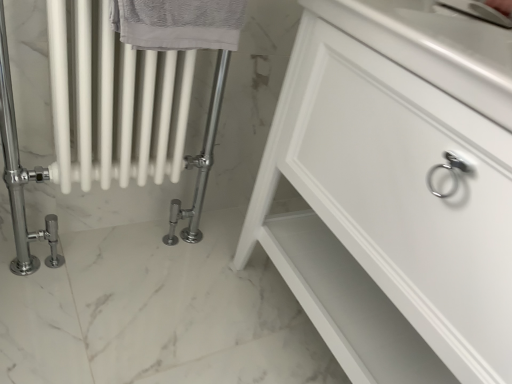
The width and height of the screenshot is (512, 384). In order to click on white glossy cabinet at center in this screenshot , I will do `click(388, 217)`.

Identify the location of white glossy radiator at left. This screenshot has height=384, width=512. (106, 119).

Is point (145, 48) positioned before point (121, 103)?

Yes, point (145, 48) is in front of point (121, 103).

Does gray textured towel at upper left lie in front of white glossy radiator at left?

Yes, gray textured towel at upper left is in front of white glossy radiator at left.

Is gray textured towel at upper left positioned far away from white glossy radiator at left?

No, gray textured towel at upper left is not far from white glossy radiator at left.

Can you tell me how much gray textured towel at upper left and white glossy radiator at left differ in facing direction?

There is a 0.00407-degree angle between the facing directions of gray textured towel at upper left and white glossy radiator at left.

Is white glossy cabinet at center bigger or smaller than white glossy radiator at left?

Clearly, white glossy cabinet at center is larger in size than white glossy radiator at left.

From the image's perspective, does white glossy cabinet at center appear higher than white glossy radiator at left?

No.

From a real-world perspective, is white glossy cabinet at center above or below white glossy radiator at left?

Clearly, from a real-world perspective, white glossy cabinet at center is above white glossy radiator at left.

Can you tell me how much white glossy cabinet at center and white glossy radiator at left differ in facing direction?

There is a 90.8-degree angle between the facing directions of white glossy cabinet at center and white glossy radiator at left.

I want to click on bath towel above the white glossy cabinet at center (from a real-world perspective), so pos(178,23).

Considering their positions, is white glossy cabinet at center located in front of or behind gray textured towel at upper left?

white glossy cabinet at center is in front of gray textured towel at upper left.

Is white glossy cabinet at center in contact with gray textured towel at upper left?

No, white glossy cabinet at center is not with gray textured towel at upper left.

Is white glossy radiator at left next to gray textured towel at upper left and touching it?

No, white glossy radiator at left is not touching gray textured towel at upper left.

Looking at this image, which is closer to the camera, [192,227] or [220,0]?

Point [192,227] appears to be farther away from the viewer than point [220,0].

From a real-world perspective, which is physically below, white glossy radiator at left or gray textured towel at upper left?

white glossy radiator at left is physically lower.

Between white glossy radiator at left and gray textured towel at upper left, which one appears on the left side from the viewer's perspective?

white glossy radiator at left.

Considering their positions, is white glossy radiator at left located in front of or behind white glossy cabinet at center?

Clearly, white glossy radiator at left is behind white glossy cabinet at center.

Is white glossy radiator at left turned away from white glossy cabinet at center?

No, white glossy radiator at left is not facing the opposite direction of white glossy cabinet at center.

Would you consider white glossy radiator at left to be distant from white glossy cabinet at center?

No, white glossy radiator at left is not far away from white glossy cabinet at center.

Based on their positions, is white glossy radiator at left located to the left or right of white glossy cabinet at center?

white glossy radiator at left is positioned on white glossy cabinet at center's left side.

From the image's perspective, is gray textured towel at upper left beneath white glossy cabinet at center?

No, from the image's perspective, gray textured towel at upper left is not beneath white glossy cabinet at center.

Image resolution: width=512 pixels, height=384 pixels. There is a white glossy cabinet at center. What are the coordinates of `bath towel above it (from a real-world perspective)` in the screenshot? It's located at (178, 23).

Considering the relative sizes of gray textured towel at upper left and white glossy cabinet at center in the image provided, is gray textured towel at upper left wider than white glossy cabinet at center?

No, gray textured towel at upper left is not wider than white glossy cabinet at center.

I want to click on bath below the gray textured towel at upper left (from the image's perspective), so click(106, 119).

Find the location of a particular element. The image size is (512, 384). bath that is behind the white glossy cabinet at center is located at coordinates (106, 119).

Based on the photo, when comparing their distances from white glossy radiator at left, does gray textured towel at upper left or white glossy cabinet at center seem closer?

Among the two, gray textured towel at upper left is located nearer to white glossy radiator at left.

Estimate the real-world distances between objects in this image. Which object is further from gray textured towel at upper left, white glossy radiator at left or white glossy cabinet at center?

white glossy cabinet at center lies further to gray textured towel at upper left than the other object.

From the picture: Considering their positions, is gray textured towel at upper left positioned further to white glossy cabinet at center than white glossy radiator at left?

gray textured towel at upper left.

Considering their positions, is white glossy cabinet at center positioned closer to white glossy radiator at left than gray textured towel at upper left?

Among the two, gray textured towel at upper left is located nearer to white glossy radiator at left.

From the picture: Looking at the image, which one is located closer to white glossy cabinet at center, white glossy radiator at left or gray textured towel at upper left?

white glossy radiator at left is positioned closer to the anchor white glossy cabinet at center.

Which object lies further to the anchor point gray textured towel at upper left, white glossy cabinet at center or white glossy radiator at left?

white glossy cabinet at center is further to gray textured towel at upper left.

The height and width of the screenshot is (384, 512). What are the coordinates of `bath towel situated between white glossy radiator at left and white glossy cabinet at center from left to right` in the screenshot? It's located at (178, 23).